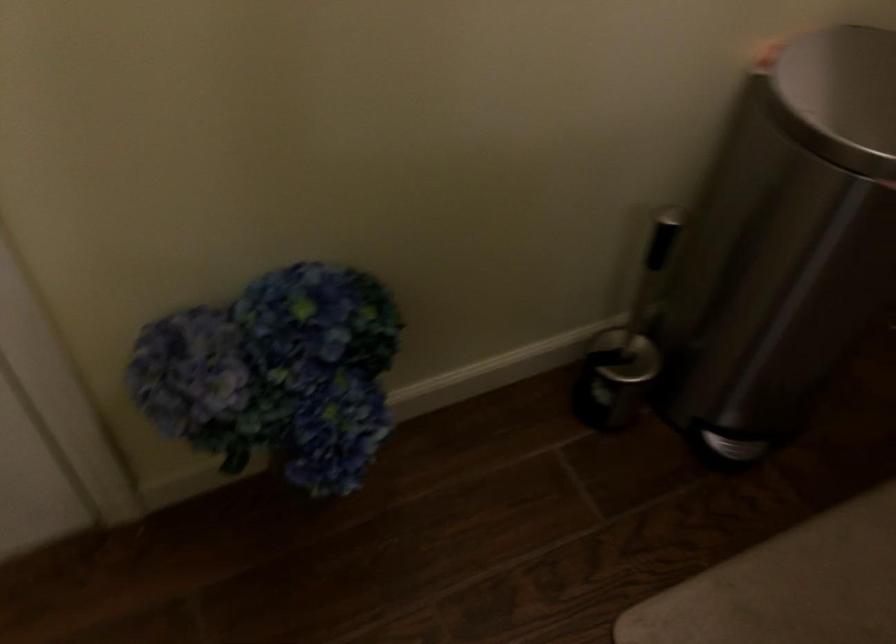
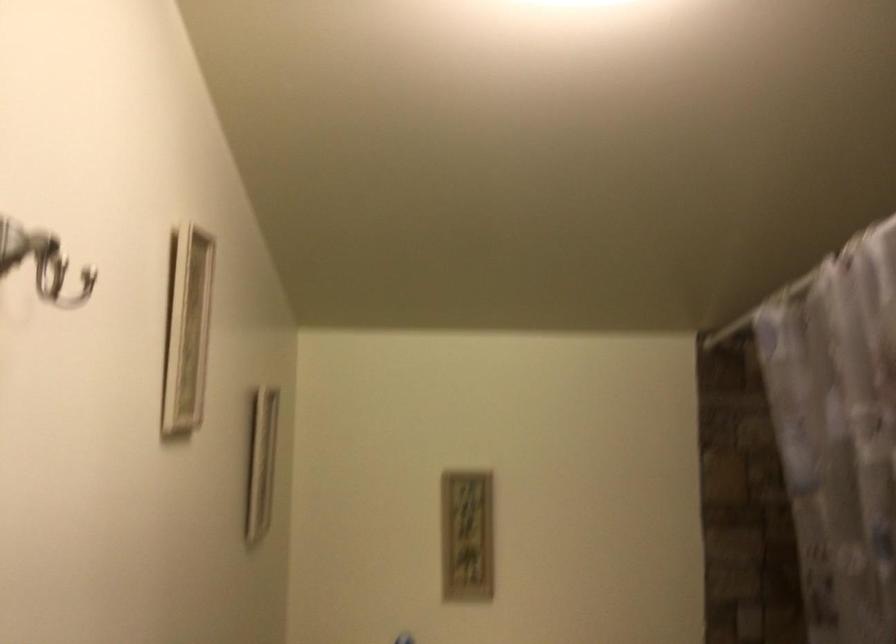
First-person continuous shooting, in which direction is the camera rotating?

The rotation direction of the camera is right-up.